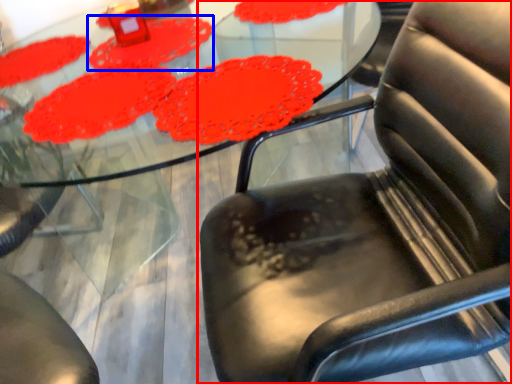
Question: Among these objects, which one is nearest to the camera, chair (highlighted by a red box) or mat (highlighted by a blue box)?

Choices:
 (A) chair
 (B) mat

Answer: (A)